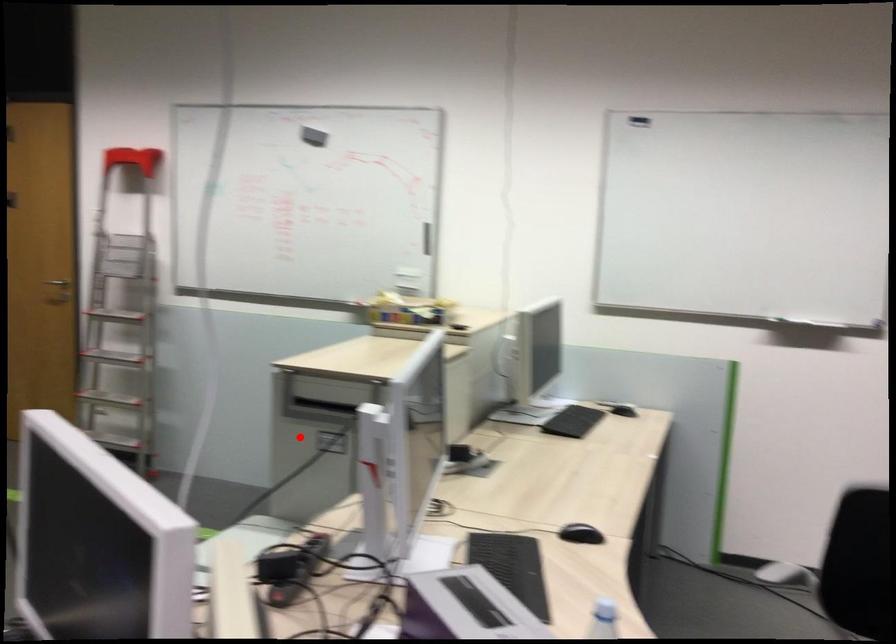
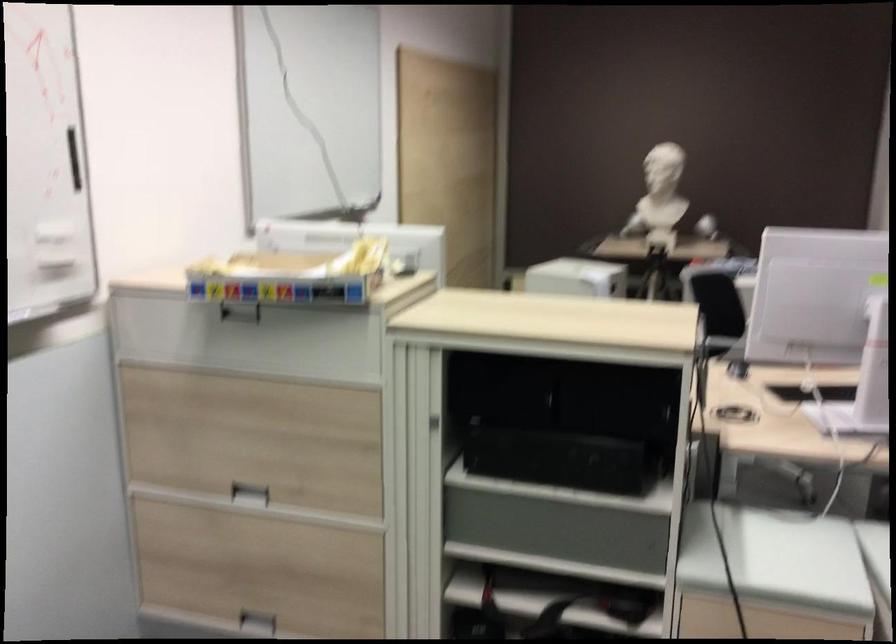
The point at the highlighted location is marked in the first image. Where is the corresponding point in the second image?

(597, 459)